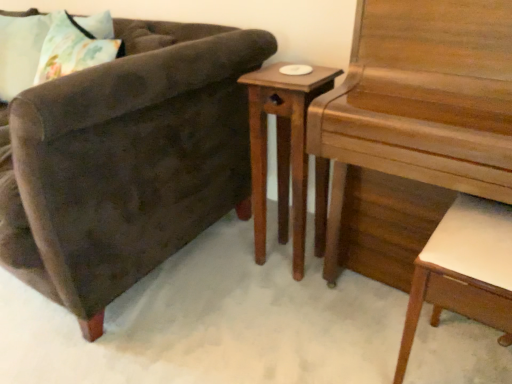
Find the location of a particular element. free space to the left of white leather desk at lower right is located at coordinates (348, 347).